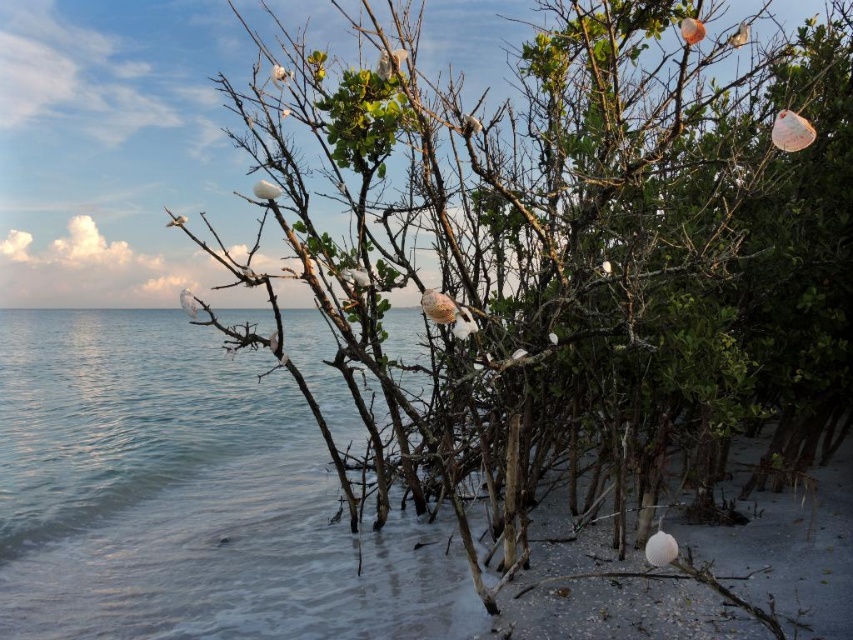
You are standing at the camera position looking at the serene coastal scene. There is a specific point marked at coordinates point (341, 534). Can you estimate how far this point is from your current position?

The point (341, 534) is 8.26 meters away from the camera position.

You are a photographer planning to capture the scene with the clear water at lower left and the white fluffy bird at center. Which object in the frame takes up more space?

The clear water at lower left takes up more space in the frame as it is bigger than the white fluffy bird at center.

You are standing on the beach and see two points marked on the sand. The first point is labeled as point (196, 300) and the second is point (355, 268). If you walk towards the ocean from your current position, which point will you encounter first?

Point (355, 268) will be encountered first because it is in front of point (196, 300), which is behind it.